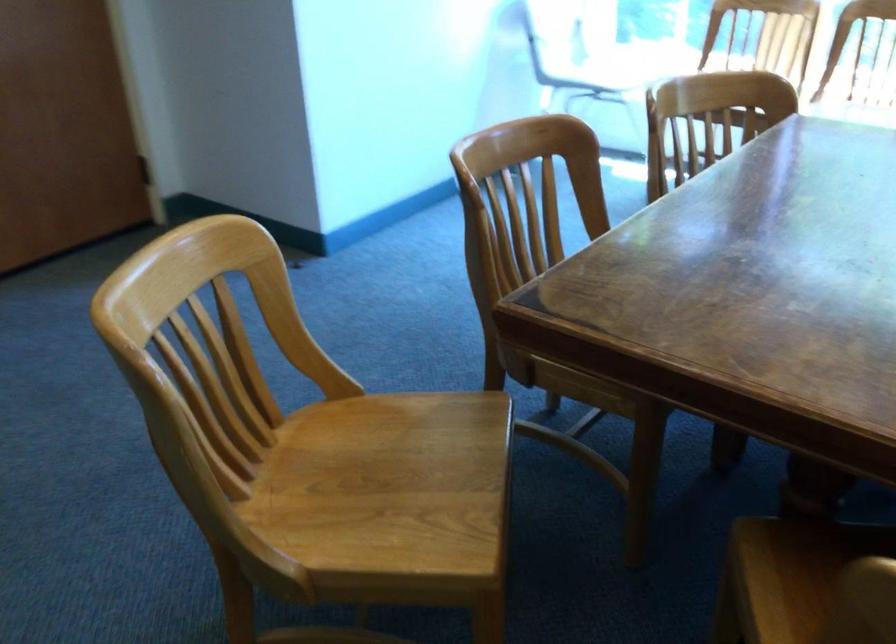
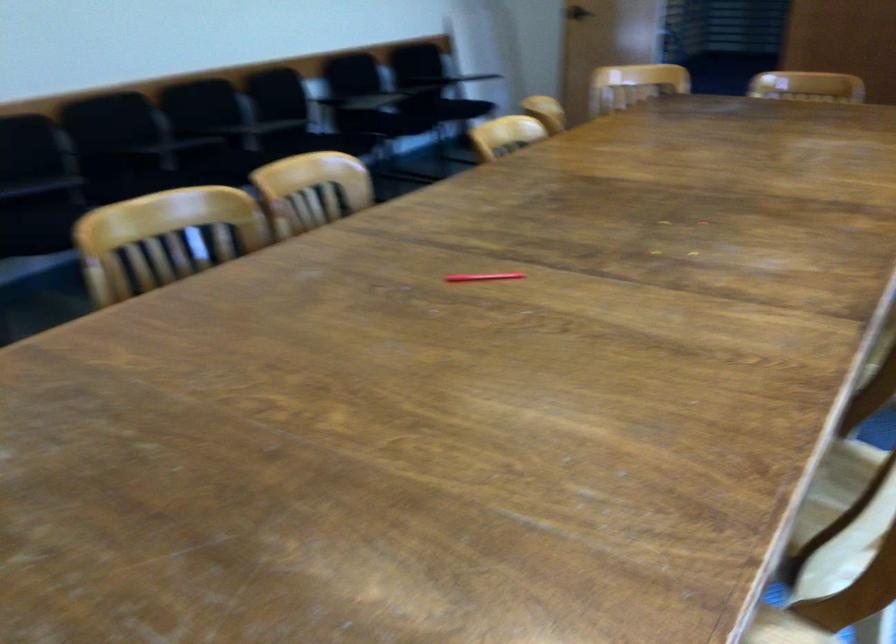
Question: I am providing you with two images of the same scene from different viewpoints. Which of the following objects are not visible in image2?

Choices:
 (A) black chair sitting surface
 (B) wooden chair sitting surface
 (C) wire drawer front
 (D) red pen

Answer: (B)